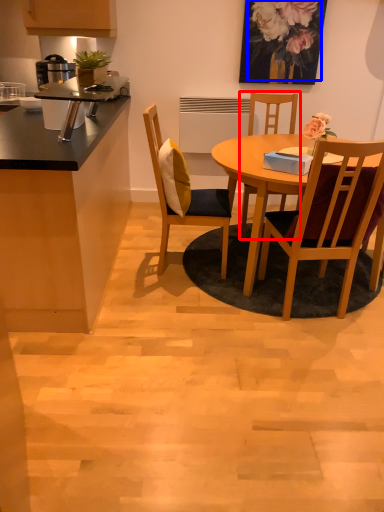
Question: Which object appears farthest to the camera in this image, chair (highlighted by a red box) or floral arrangement (highlighted by a blue box)?

Choices:
 (A) chair
 (B) floral arrangement

Answer: (B)